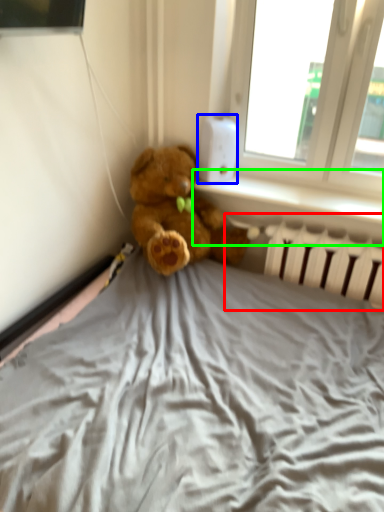
Question: Which object is the closest to the radiator (highlighted by a red box)? Choose among these: thermostat (highlighted by a blue box) or window sill (highlighted by a green box).

Choices:
 (A) thermostat
 (B) window sill

Answer: (B)